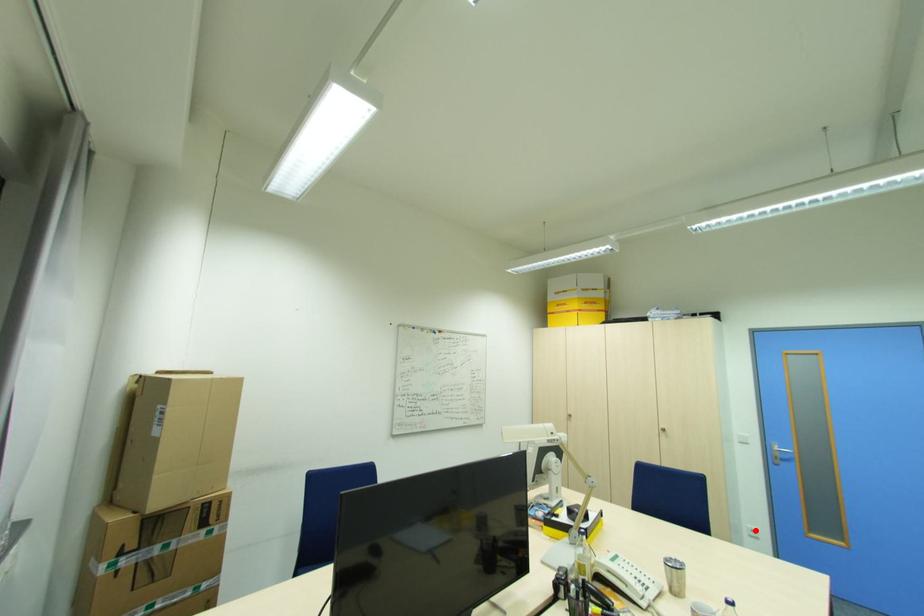
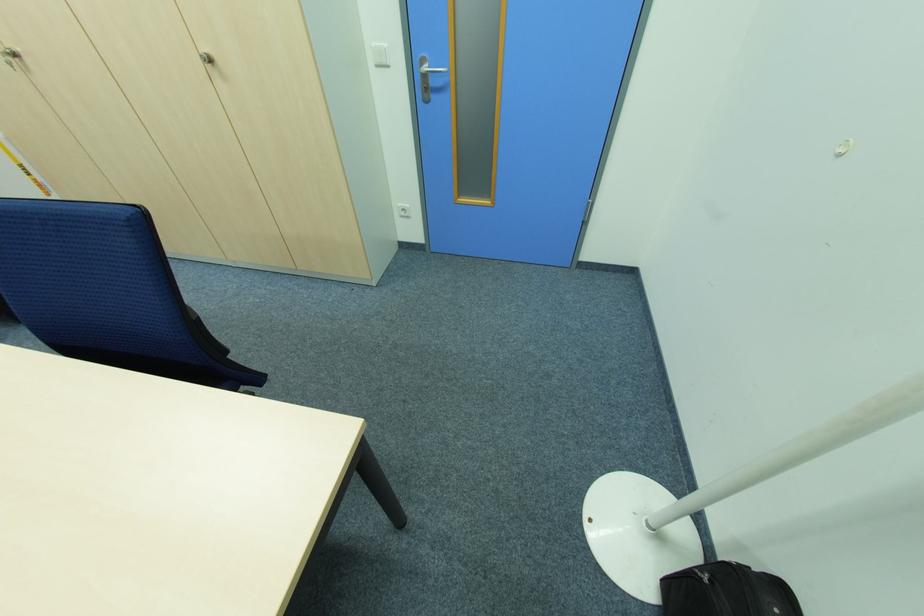
Question: I am providing you with two images of the same scene from different viewpoints. Given a red point in image1, look at the same physical point in image2. Is it:

Choices:
 (A) Closer to the viewpoint
 (B) Farther from the viewpoint

Answer: (A)